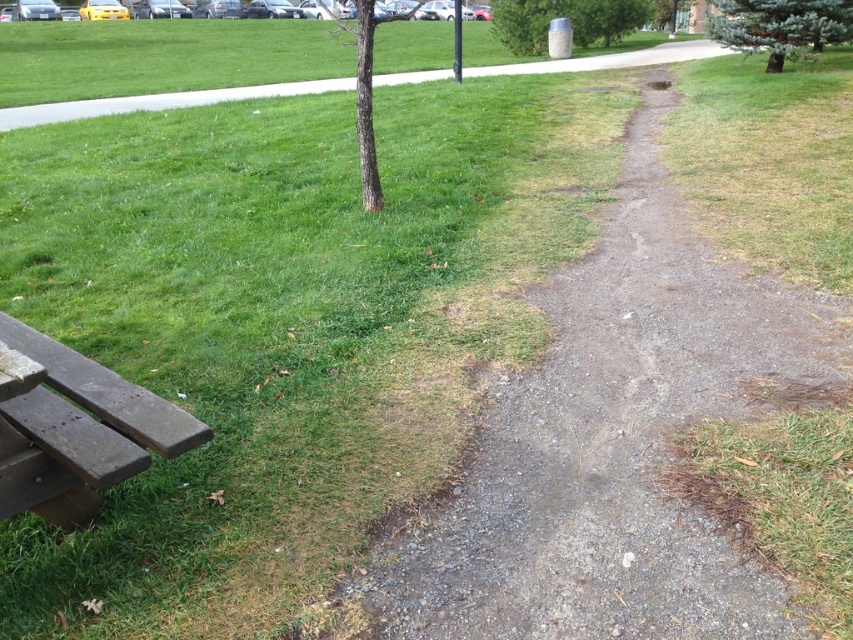
You are planning to set up a small picnic area in the park. You want to place a picnic blanket under the gray textured trash can at upper center. Is there enough space to do so without overlapping with the weathered wood bench at lower left?

The weathered wood bench at lower left is positioned under the gray textured trash can at upper center, so placing the picnic blanket under the gray textured trash can at upper center would overlap with the weathered wood bench at lower left. Therefore, there isn not enough space to place the picnic blanket there without overlapping.

You are planning to set up a small picnic for two people. You have a blanket and some snacks. The weathered wood bench at lower left and the gray textured trash can at upper center are in your view. Which object would be more suitable for placing your picnic items, considering their sizes?

The weathered wood bench at lower left has a smaller size compared to the gray textured trash can at upper center. Therefore, the gray textured trash can at upper center is larger and more suitable for placing picnic items.